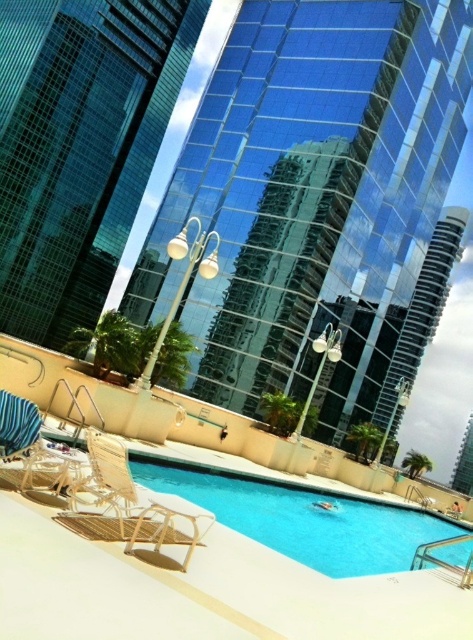
Question: Is glassy blue building at upper left to the right of blue glossy water at center from the viewer's perspective?

Choices:
 (A) no
 (B) yes

Answer: (A)

Question: Which of the following is the closest to the observer?

Choices:
 (A) (131, 131)
 (B) (228, 486)
 (C) (208, 92)

Answer: (B)

Question: Does transparent glass building at center appear over glassy blue building at upper left?

Choices:
 (A) yes
 (B) no

Answer: (B)

Question: Which object appears farthest from the camera in this image?

Choices:
 (A) glassy blue building at upper left
 (B) blue glossy water at center
 (C) beige woven beach chair at lower left

Answer: (A)

Question: Does blue glossy water at center have a smaller size compared to beige woven beach chair at lower left?

Choices:
 (A) yes
 (B) no

Answer: (B)

Question: Which object appears farthest from the camera in this image?

Choices:
 (A) beige woven beach chair at lower left
 (B) glassy blue building at upper left

Answer: (B)